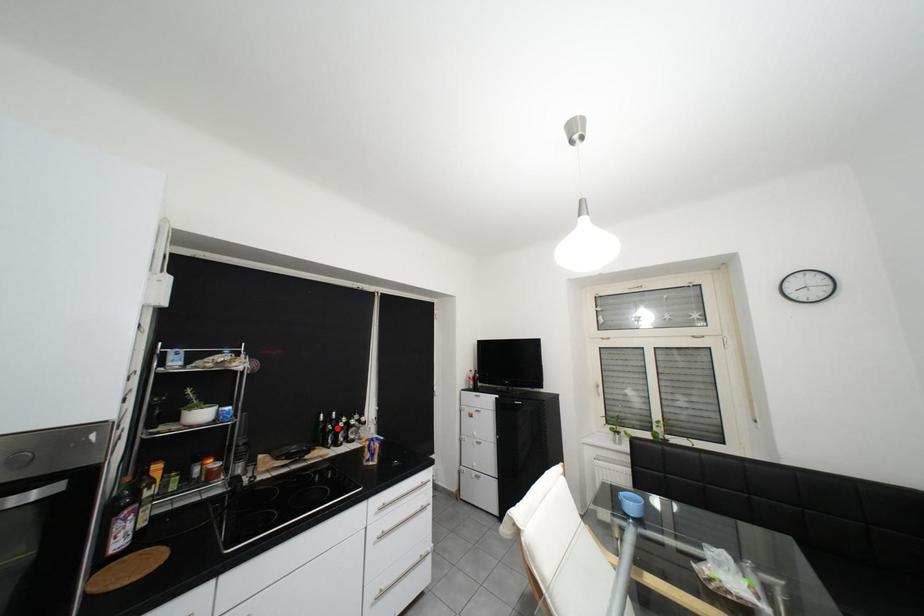
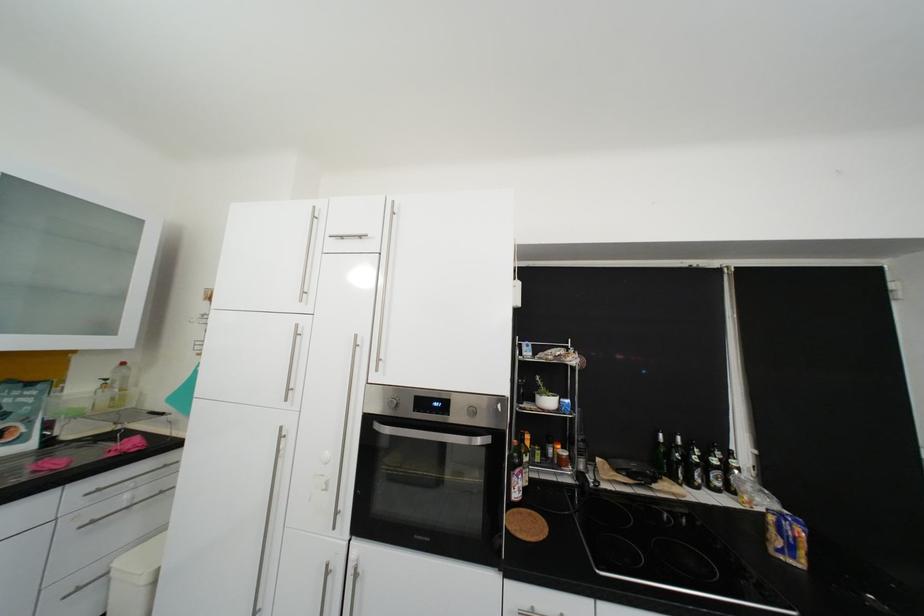
Where in the second image is the point corresponding to the highlighted location from the first image?

(682, 454)